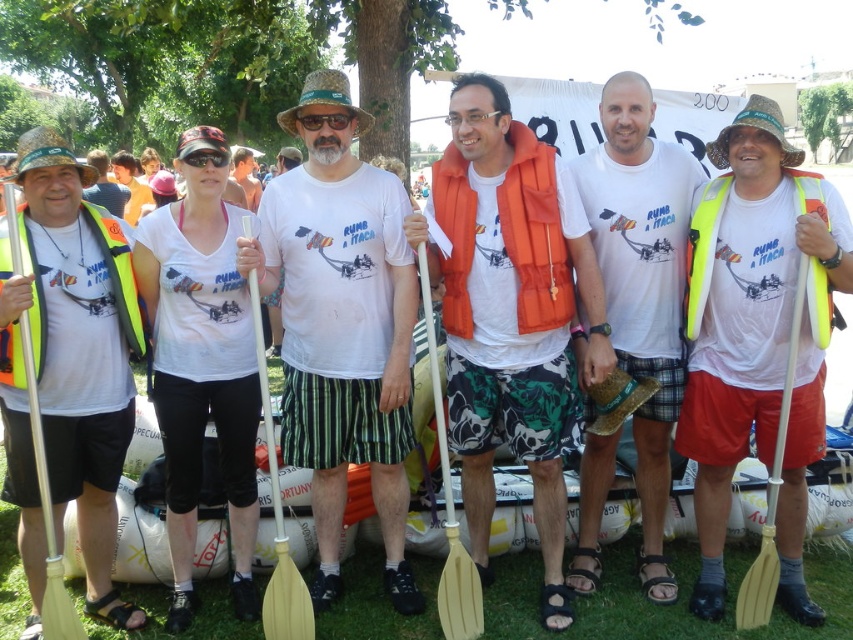
Question: Is orange fabric life vest at center above yellow wood paddle at center?

Choices:
 (A) no
 (B) yes

Answer: (B)

Question: Among these points, which one is nearest to the camera?

Choices:
 (A) coord(747,618)
 (B) coord(473,636)

Answer: (B)

Question: Which object is closer to the camera taking this photo?

Choices:
 (A) yellow plastic paddle at center
 (B) wooden paddle at center
 (C) black plastic goggles at center
 (D) white matte t-shirt at center

Answer: (B)

Question: Estimate the real-world distances between objects in this image. Which object is farther from the black reflective goggles at center?

Choices:
 (A) white matte t-shirt at center
 (B) white t-shirt at center

Answer: (A)

Question: Is orange fabric life vest at center bigger than black reflective goggles at center?

Choices:
 (A) no
 (B) yes

Answer: (B)

Question: Observing the image, what is the correct spatial positioning of yellow foam paddle at left in reference to matte yellow vest at left?

Choices:
 (A) left
 (B) right

Answer: (B)